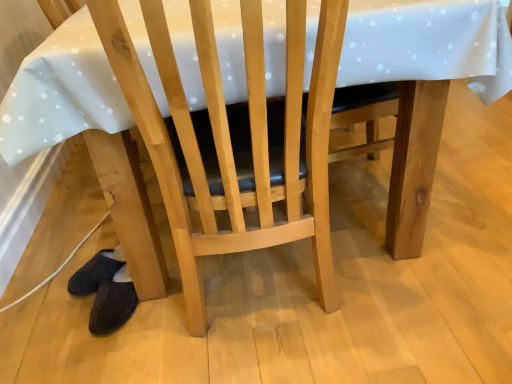
Locate an element on the screen. The image size is (512, 384). wooden chair at center is located at coordinates (234, 137).

Describe the element at coordinates (234, 137) in the screenshot. This screenshot has width=512, height=384. I see `wooden chair at center` at that location.

Find the location of a particular element. This screenshot has height=384, width=512. dark blue fuzzy slippers at lower left is located at coordinates (113, 303).

The width and height of the screenshot is (512, 384). What do you see at coordinates (113, 303) in the screenshot? I see `dark blue fuzzy slippers at lower left` at bounding box center [113, 303].

Image resolution: width=512 pixels, height=384 pixels. Find the location of `wooden chair at center`. wooden chair at center is located at coordinates (234, 137).

Which object is positioned more to the right, wooden chair at center or dark blue fuzzy slippers at lower left?

Positioned to the right is wooden chair at center.

Is wooden chair at center positioned behind dark blue fuzzy slippers at lower left?

No, wooden chair at center is closer to the camera.

Does point (266, 123) come in front of point (122, 298)?

Yes, point (266, 123) is closer to viewer.

From the image's perspective, would you say wooden chair at center is shown under dark blue fuzzy slippers at lower left?

Incorrect, from the image's perspective, wooden chair at center is higher than dark blue fuzzy slippers at lower left.

From a real-world perspective, is wooden chair at center physically above dark blue fuzzy slippers at lower left?

Indeed, from a real-world perspective, wooden chair at center stands above dark blue fuzzy slippers at lower left.

Can you confirm if wooden chair at center is wider than dark blue fuzzy slippers at lower left?

Yes.

Considering the sizes of objects wooden chair at center and dark blue fuzzy slippers at lower left in the image provided, who is shorter, wooden chair at center or dark blue fuzzy slippers at lower left?

With less height is dark blue fuzzy slippers at lower left.

Is wooden chair at center bigger than dark blue fuzzy slippers at lower left?

Indeed, wooden chair at center has a larger size compared to dark blue fuzzy slippers at lower left.

Is wooden chair at center not within dark blue fuzzy slippers at lower left?

Yes, wooden chair at center is outside of dark blue fuzzy slippers at lower left.

Is wooden chair at center not near dark blue fuzzy slippers at lower left?

No.

Is dark blue fuzzy slippers at lower left at the back of wooden chair at center?

That's not correct — wooden chair at center is not looking away from dark blue fuzzy slippers at lower left.

Can you tell me how much wooden chair at center and dark blue fuzzy slippers at lower left differ in facing direction?

The angle between the facing direction of wooden chair at center and the facing direction of dark blue fuzzy slippers at lower left is 172 degrees.

This screenshot has width=512, height=384. I want to click on chair above the dark blue fuzzy slippers at lower left (from a real-world perspective), so (234, 137).

Is dark blue fuzzy slippers at lower left to the left or to the right of wooden chair at center in the image?

In the image, dark blue fuzzy slippers at lower left appears on the left side of wooden chair at center.

Is the position of dark blue fuzzy slippers at lower left more distant than that of wooden chair at center?

Yes.

Considering the points (115, 298) and (305, 15), which point is in front, point (115, 298) or point (305, 15)?

The point (305, 15) is closer to the camera.

From the image's perspective, is dark blue fuzzy slippers at lower left on top of wooden chair at center?

Actually, dark blue fuzzy slippers at lower left appears below wooden chair at center in the image.

From a real-world perspective, is dark blue fuzzy slippers at lower left under wooden chair at center?

Yes.

Can you confirm if dark blue fuzzy slippers at lower left is wider than wooden chair at center?

No, dark blue fuzzy slippers at lower left is not wider than wooden chair at center.

Considering the relative sizes of dark blue fuzzy slippers at lower left and wooden chair at center in the image provided, is dark blue fuzzy slippers at lower left shorter than wooden chair at center?

Yes.

Considering the sizes of dark blue fuzzy slippers at lower left and wooden chair at center in the image, is dark blue fuzzy slippers at lower left bigger or smaller than wooden chair at center?

Considering their sizes, dark blue fuzzy slippers at lower left takes up less space than wooden chair at center.

Choose the correct answer: Is dark blue fuzzy slippers at lower left inside wooden chair at center or outside it?

dark blue fuzzy slippers at lower left cannot be found inside wooden chair at center.

Is dark blue fuzzy slippers at lower left directly adjacent to wooden chair at center?

No, dark blue fuzzy slippers at lower left is not touching wooden chair at center.

Is dark blue fuzzy slippers at lower left oriented towards wooden chair at center?

No.

Can you tell me how much dark blue fuzzy slippers at lower left and wooden chair at center differ in facing direction?

They differ by 172 degrees in their facing directions.

How much distance is there between dark blue fuzzy slippers at lower left and wooden chair at center?

They are 22.62 inches apart.

Where is `chair on the right of dark blue fuzzy slippers at lower left`? Image resolution: width=512 pixels, height=384 pixels. chair on the right of dark blue fuzzy slippers at lower left is located at coordinates (234, 137).

In order to click on footwear on the left of wooden chair at center in this screenshot , I will do `click(113, 303)`.

At what (x,y) coordinates should I click in order to perform the action: click on footwear below the wooden chair at center (from the image's perspective). Please return your answer as a coordinate pair (x, y). The image size is (512, 384). Looking at the image, I should click on (113, 303).